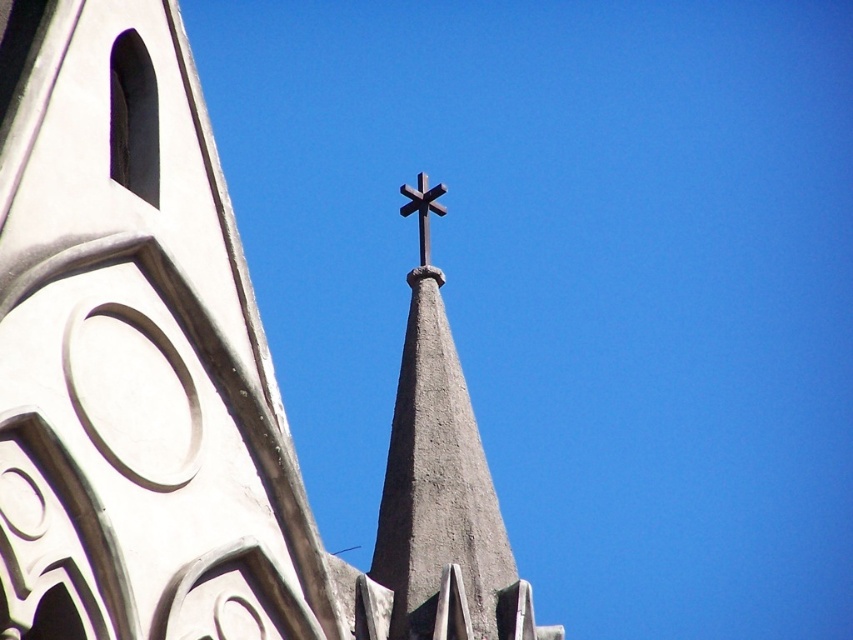
You are standing in front of a church and notice the smooth gray steeple at center and the dark brown wooden cross at center. According to the image, which object is positioned to the left?

The smooth gray steeple at center is to the left of the dark brown wooden cross at center, so the smooth gray steeple at center is positioned to the left.